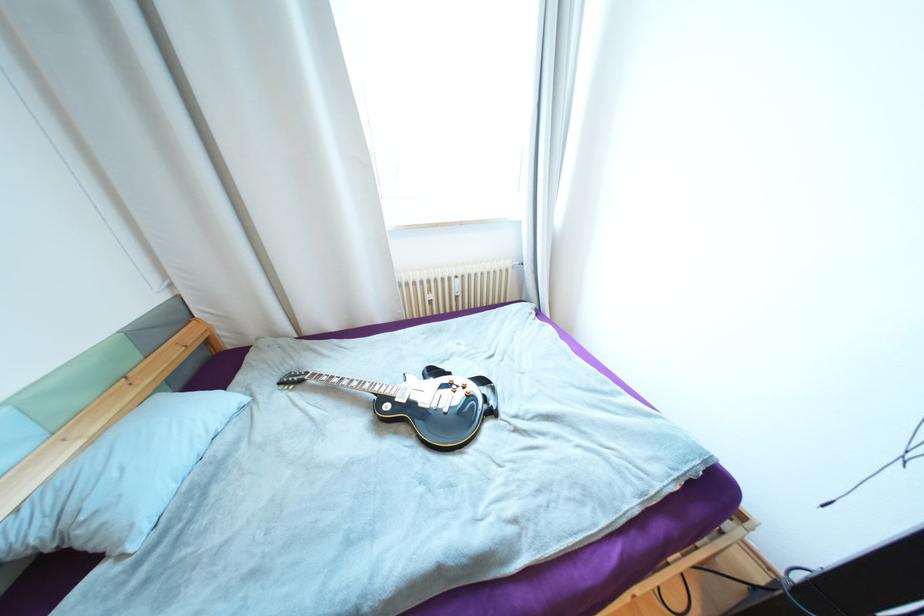
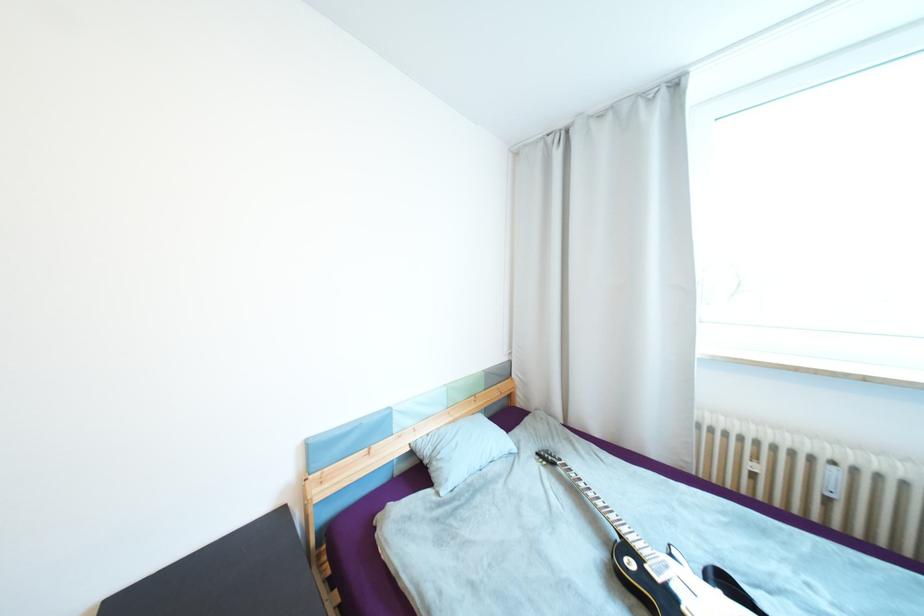
Question: The first image is from the beginning of the video and the second image is from the end. How did the camera likely rotate when shooting the video?

Choices:
 (A) Left
 (B) Right
 (C) Up
 (D) Down

Answer: (A)